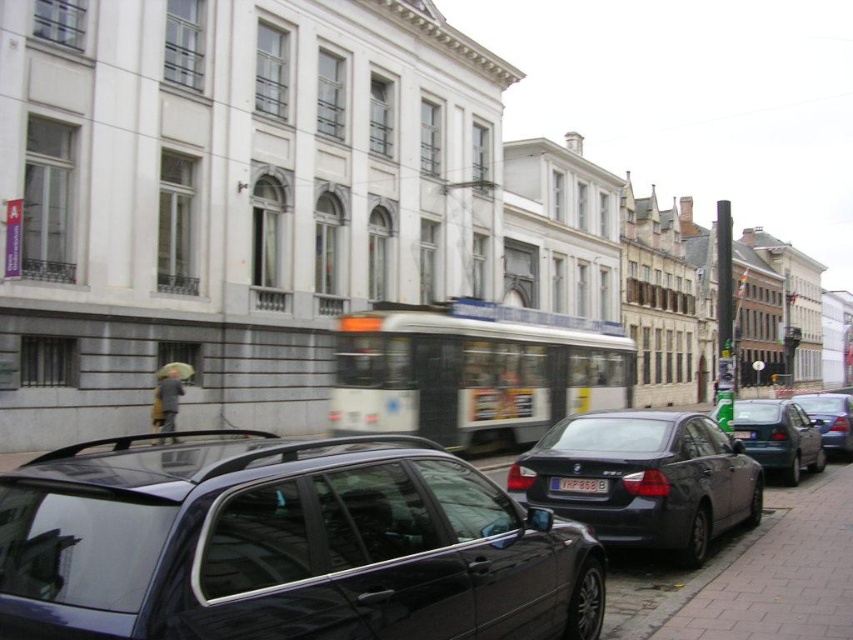
Question: Estimate the real-world distances between objects in this image. Which object is farther from the metallic silver sedan at center?

Choices:
 (A) brick pavement at lower right
 (B) white plastic license plate at center

Answer: (A)

Question: Which point appears closest to the camera in this image?

Choices:
 (A) (265, 433)
 (B) (695, 540)
 (C) (705, 602)
 (D) (567, 477)

Answer: (C)

Question: Is brick pavement at lower right thinner than matte black sedan at right?

Choices:
 (A) yes
 (B) no

Answer: (A)

Question: Is the position of shiny black car at center less distant than that of brick pavement at lower right?

Choices:
 (A) yes
 (B) no

Answer: (A)

Question: Does matte black sedan at right appear over white plastic license plate at center?

Choices:
 (A) yes
 (B) no

Answer: (B)

Question: Which of the following is the farthest from the observer?

Choices:
 (A) matte black sedan at right
 (B) brick pavement at lower right
 (C) metallic silver sedan at center

Answer: (C)